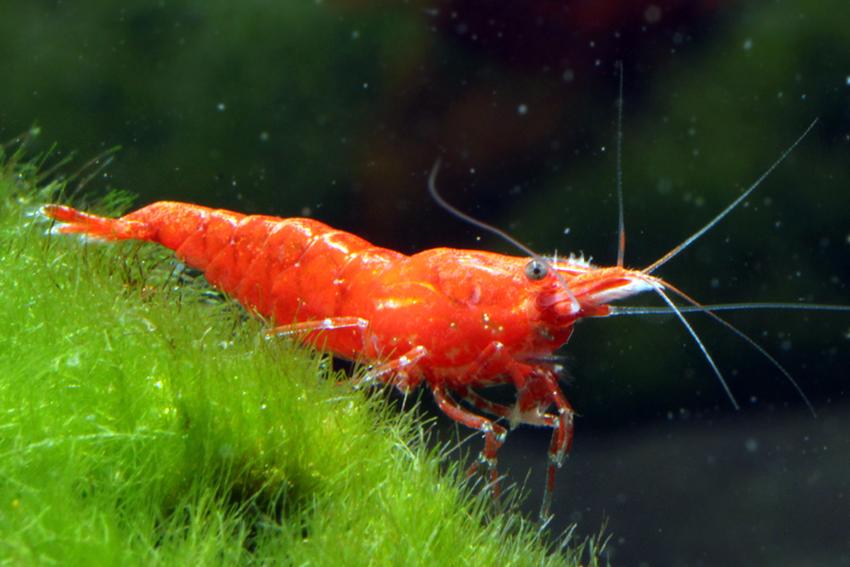
At what (x,y) coordinates should I click in order to perform the action: click on corner. Please return your answer as a coordinate pair (x, y). Looking at the image, I should click on (826, 551), (7, 551), (23, 49), (826, 16), (826, 98).